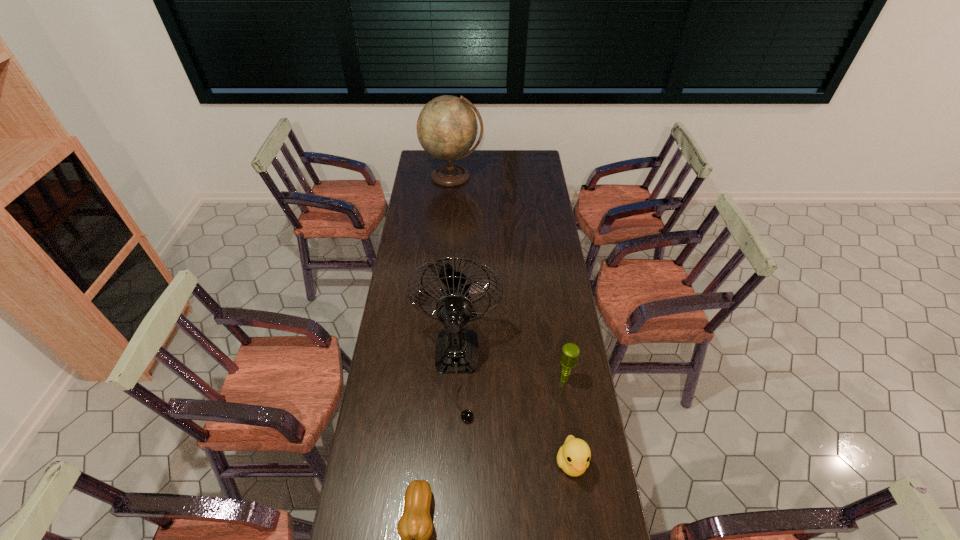
The height and width of the screenshot is (540, 960). What are the coordinates of `globe present at the left edge` in the screenshot? It's located at (447, 127).

The image size is (960, 540). Find the location of `fan that is at the left edge`. fan that is at the left edge is located at coordinates (456, 351).

This screenshot has height=540, width=960. I want to click on microphone situated at the right edge, so click(569, 357).

At what (x,y) coordinates should I click in order to perform the action: click on duck located in the right edge section of the desktop. Please return your answer as a coordinate pair (x, y). The height and width of the screenshot is (540, 960). Looking at the image, I should click on (573, 457).

Where is `object that is at the far left corner`? object that is at the far left corner is located at coordinates (447, 127).

The width and height of the screenshot is (960, 540). Identify the location of vacant region at the far edge of the desktop. (480, 170).

Identify the location of free region at the left edge of the desktop. (411, 351).

Where is `free location at the right edge of the desktop`? free location at the right edge of the desktop is located at coordinates (543, 345).

Identify the location of vacant area that lies between the second nearest object and the microphone. (568, 421).

Identify the location of unoccupied position between the fan and the microphone. This screenshot has width=960, height=540. (511, 374).